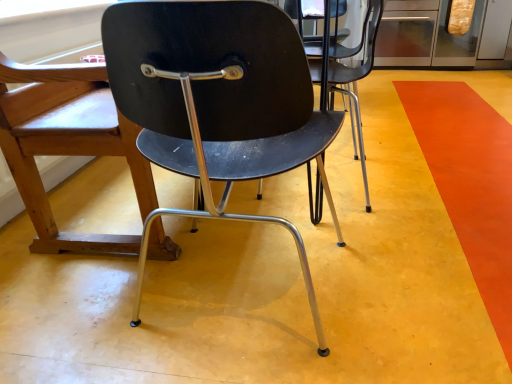
Image resolution: width=512 pixels, height=384 pixels. Identify the location of free area below matte black chair at center, the 1th chair viewed from the front (from a real-world perspective). (244, 273).